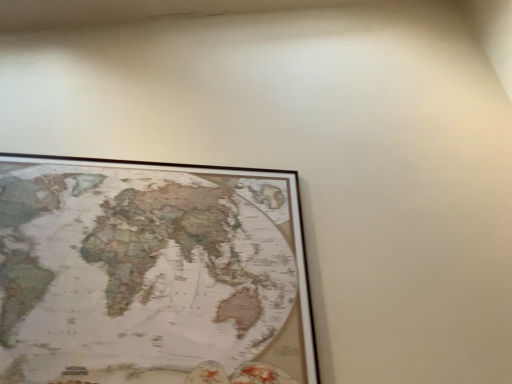
What do you see at coordinates (151, 274) in the screenshot?
I see `wooden map at upper left` at bounding box center [151, 274].

This screenshot has width=512, height=384. What are the coordinates of `wooden map at upper left` in the screenshot? It's located at (151, 274).

The height and width of the screenshot is (384, 512). Find the location of `wooden map at upper left`. wooden map at upper left is located at coordinates (151, 274).